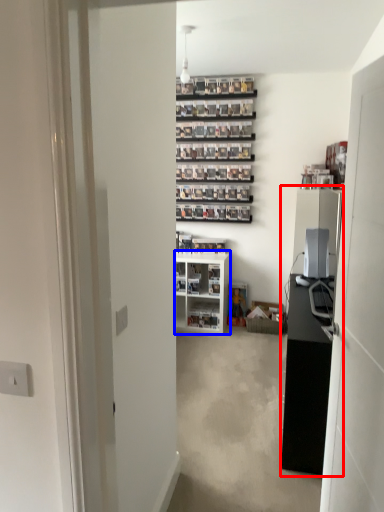
Question: Which of the following is the closest to the observer, entertainment center (highlighted by a red box) or cabinetry (highlighted by a blue box)?

Choices:
 (A) entertainment center
 (B) cabinetry

Answer: (A)